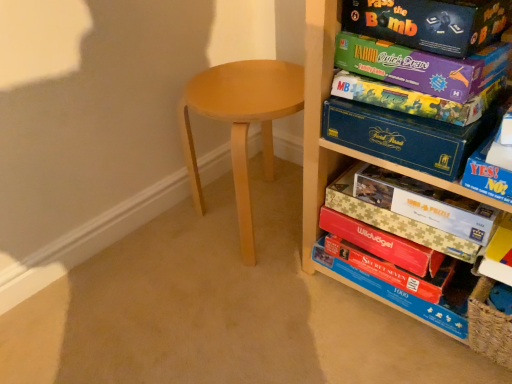
In order to face red matte puzzle box at lower right, the 6th paperback book in the top-to-bottom sequence, should I rotate leftwards or rightwards?

Rotate your view right by about 17.339°.

Describe the element at coordinates (429, 23) in the screenshot. The image size is (512, 384). I see `matte black game box at upper right, arranged as the sixth paperback book when ordered from the bottom` at that location.

What is the approximate height of matte purple board game at upper right, the third paperback book in the top-to-bottom sequence?

matte purple board game at upper right, the third paperback book in the top-to-bottom sequence, is 1.65 inches in height.

Identify the location of blue cardboard box at right, which ranks as the 3th paperback book in bottom-to-top order. (403, 136).

What do you see at coordinates (241, 123) in the screenshot?
I see `light brown wood stool at center` at bounding box center [241, 123].

Find the location of `blue cardboard box at right`. blue cardboard box at right is located at coordinates (490, 170).

I want to click on red matte puzzle box at lower right, the 6th paperback book in the top-to-bottom sequence, so click(392, 270).

Can you confirm if matte cardboard game box at upper right, which is counted as the 2th paperback book, starting from the top, is positioned to the right of matte black game box at upper right, arranged as the sixth paperback book when ordered from the bottom?

Correct, you'll find matte cardboard game box at upper right, which is counted as the 2th paperback book, starting from the top, to the right of matte black game box at upper right, arranged as the sixth paperback book when ordered from the bottom.

From a real-world perspective, relative to matte black game box at upper right, arranged as the sixth paperback book when ordered from the bottom, is matte cardboard game box at upper right, which is the fifth paperback book in bottom-to-top order, vertically above or below?

In terms of real-world spatial position, matte cardboard game box at upper right, which is the fifth paperback book in bottom-to-top order, is below matte black game box at upper right, arranged as the sixth paperback book when ordered from the bottom.

Where is `paperback book that is the 1st one when counting rightward from the matte black game box at upper right, arranged as the sixth paperback book when ordered from the bottom`? paperback book that is the 1st one when counting rightward from the matte black game box at upper right, arranged as the sixth paperback book when ordered from the bottom is located at coordinates (420, 66).

Considering the relative positions of matte cardboard game box at upper right, which is counted as the 2th paperback book, starting from the top, and matte black game box at upper right, arranged as the sixth paperback book when ordered from the bottom, in the image provided, is matte cardboard game box at upper right, which is counted as the 2th paperback book, starting from the top, behind matte black game box at upper right, arranged as the sixth paperback book when ordered from the bottom,?

Yes.

Find the location of a particular element. book lying behind the blue cardboard box at right is located at coordinates (395, 220).

Which is behind, point (485, 158) or point (352, 165)?

The point (352, 165) is more distant.

Is blue cardboard box at right bigger than blue cardboard puzzle at lower right?

No, blue cardboard box at right is not bigger than blue cardboard puzzle at lower right.

From the image's perspective, is blue cardboard box at right located above or below blue cardboard puzzle at lower right?

Clearly, from the image's perspective, blue cardboard box at right is above blue cardboard puzzle at lower right.

Considering the positions of objects blue cardboard box at right, which ranks as the 3th paperback book in bottom-to-top order, and matte purple board game at upper right, placed as the 4th paperback book when sorted from bottom to top, in the image provided, who is behind, blue cardboard box at right, which ranks as the 3th paperback book in bottom-to-top order, or matte purple board game at upper right, placed as the 4th paperback book when sorted from bottom to top,?

matte purple board game at upper right, placed as the 4th paperback book when sorted from bottom to top, is behind.

From a real-world perspective, is blue cardboard box at right, which appears as the fourth paperback book when viewed from the top, positioned over matte purple board game at upper right, placed as the 4th paperback book when sorted from bottom to top, based on gravity?

Incorrect, from a real-world perspective, blue cardboard box at right, which appears as the fourth paperback book when viewed from the top, is lower than matte purple board game at upper right, placed as the 4th paperback book when sorted from bottom to top.

Would you consider blue cardboard box at right, which ranks as the 3th paperback book in bottom-to-top order, to be distant from matte purple board game at upper right, placed as the 4th paperback book when sorted from bottom to top?

No, blue cardboard box at right, which ranks as the 3th paperback book in bottom-to-top order, is not far away from matte purple board game at upper right, placed as the 4th paperback book when sorted from bottom to top.

In the scene shown: Considering the sizes of objects blue cardboard box at right, which appears as the fourth paperback book when viewed from the top, and matte purple board game at upper right, the third paperback book in the top-to-bottom sequence, in the image provided, who is taller, blue cardboard box at right, which appears as the fourth paperback book when viewed from the top, or matte purple board game at upper right, the third paperback book in the top-to-bottom sequence,?

Standing taller between the two is blue cardboard box at right, which appears as the fourth paperback book when viewed from the top.

Which paperback book is the 2nd one when counting from the back of the matte cardboard game box at upper right, which is the fifth paperback book in bottom-to-top order? Please provide its 2D coordinates.

[(411, 99)]

Which object is positioned more to the left, matte purple board game at upper right, placed as the 4th paperback book when sorted from bottom to top, or matte cardboard game box at upper right, which is counted as the 2th paperback book, starting from the top?

matte purple board game at upper right, placed as the 4th paperback book when sorted from bottom to top.

Is matte purple board game at upper right, placed as the 4th paperback book when sorted from bottom to top, positioned behind matte cardboard game box at upper right, which is counted as the 2th paperback book, starting from the top?

Yes, it is behind matte cardboard game box at upper right, which is counted as the 2th paperback book, starting from the top.

Is matte purple board game at upper right, placed as the 4th paperback book when sorted from bottom to top, not near matte cardboard game box at upper right, which is the fifth paperback book in bottom-to-top order?

No, matte purple board game at upper right, placed as the 4th paperback book when sorted from bottom to top, is in close proximity to matte cardboard game box at upper right, which is the fifth paperback book in bottom-to-top order.

From the picture: Is wooden shelf at right facing towards matte purple board game at upper right, the third paperback book in the top-to-bottom sequence?

Yes, wooden shelf at right is aimed at matte purple board game at upper right, the third paperback book in the top-to-bottom sequence.

Which is more to the right, wooden shelf at right or matte purple board game at upper right, the third paperback book in the top-to-bottom sequence?

wooden shelf at right.

Is wooden shelf at right bigger than matte purple board game at upper right, placed as the 4th paperback book when sorted from bottom to top?

Yes, wooden shelf at right is bigger than matte purple board game at upper right, placed as the 4th paperback book when sorted from bottom to top.

Is the position of wooden shelf at right more distant than that of matte purple board game at upper right, placed as the 4th paperback book when sorted from bottom to top?

No.

Is point (426, 151) behind point (489, 208)?

No, it is not.

Which object is positioned more to the left, blue cardboard box at right, which ranks as the 3th paperback book in bottom-to-top order, or beige cardboard puzzle at center-right, the 5th paperback book viewed from the top?

blue cardboard box at right, which ranks as the 3th paperback book in bottom-to-top order.

Looking at this image, from the image's perspective, is blue cardboard box at right, which appears as the fourth paperback book when viewed from the top, below beige cardboard puzzle at center-right, the 2th paperback book from the bottom?

No, from the image's perspective, blue cardboard box at right, which appears as the fourth paperback book when viewed from the top, is not below beige cardboard puzzle at center-right, the 2th paperback book from the bottom.

Is blue cardboard box at right, which appears as the fourth paperback book when viewed from the top, not inside beige cardboard puzzle at center-right, the 2th paperback book from the bottom?

Yes, blue cardboard box at right, which appears as the fourth paperback book when viewed from the top, is not within beige cardboard puzzle at center-right, the 2th paperback book from the bottom.

Is matte cardboard game box at upper right, which is the fifth paperback book in bottom-to-top order, surrounding matte purple board game at upper right, placed as the 4th paperback book when sorted from bottom to top?

That's incorrect, matte purple board game at upper right, placed as the 4th paperback book when sorted from bottom to top, is not inside matte cardboard game box at upper right, which is the fifth paperback book in bottom-to-top order.

Does matte cardboard game box at upper right, which is the fifth paperback book in bottom-to-top order, turn towards matte purple board game at upper right, placed as the 4th paperback book when sorted from bottom to top?

No, matte cardboard game box at upper right, which is the fifth paperback book in bottom-to-top order, is not oriented towards matte purple board game at upper right, placed as the 4th paperback book when sorted from bottom to top.

Does point (454, 69) appear closer or farther from the camera than point (479, 109)?

Point (454, 69).

Find the location of a particular element. the 1st paperback book positioned below the matte black game box at upper right, arranged as the sixth paperback book when ordered from the bottom (from a real-world perspective) is located at coordinates (420, 66).

Find the location of a particular element. Image resolution: width=512 pixels, height=384 pixels. book behind the blue cardboard box at right is located at coordinates (395, 220).

Based on their spatial positions, is matte black game box at upper right, arranged as the sixth paperback book when ordered from the bottom, or blue cardboard puzzle at lower right closer to beige cardboard puzzle at center-right, the 2th paperback book from the bottom?

blue cardboard puzzle at lower right lies closer to beige cardboard puzzle at center-right, the 2th paperback book from the bottom, than the other object.

Looking at the image, which one is located closer to wooden shelf at right, matte cardboard game box at upper right, which is counted as the 2th paperback book, starting from the top, or blue cardboard puzzle at lower right?

The object closer to wooden shelf at right is blue cardboard puzzle at lower right.

Looking at the image, which one is located further to blue cardboard puzzle at lower right, blue cardboard box at right, which ranks as the 3th paperback book in bottom-to-top order, or blue cardboard box at right?

blue cardboard box at right is further to blue cardboard puzzle at lower right.

Looking at the image, which one is located closer to matte purple board game at upper right, the third paperback book in the top-to-bottom sequence, matte cardboard game box at upper right, which is the fifth paperback book in bottom-to-top order, or red matte puzzle box at lower right, the 6th paperback book in the top-to-bottom sequence?

matte cardboard game box at upper right, which is the fifth paperback book in bottom-to-top order, is positioned closer to the anchor matte purple board game at upper right, the third paperback book in the top-to-bottom sequence.

Looking at the image, which one is located further to blue cardboard puzzle at lower right, matte purple board game at upper right, the third paperback book in the top-to-bottom sequence, or matte black game box at upper right, arranged as the sixth paperback book when ordered from the bottom?

Among the two, matte black game box at upper right, arranged as the sixth paperback book when ordered from the bottom, is located further to blue cardboard puzzle at lower right.

When comparing their distances from wooden shelf at right, does red matte puzzle box at lower right, the 1th paperback book from the bottom, or beige cardboard puzzle at center-right, the 5th paperback book viewed from the top, seem closer?

beige cardboard puzzle at center-right, the 5th paperback book viewed from the top, is positioned closer to the anchor wooden shelf at right.

Which object lies nearer to the anchor point light brown wood stool at center, beige cardboard puzzle at center-right, the 5th paperback book viewed from the top, or matte cardboard game box at upper right, which is counted as the 2th paperback book, starting from the top?

matte cardboard game box at upper right, which is counted as the 2th paperback book, starting from the top.

Looking at the image, which one is located further to matte black game box at upper right, arranged as the sixth paperback book when ordered from the bottom, beige cardboard puzzle at center-right, the 5th paperback book viewed from the top, or blue cardboard box at right?

beige cardboard puzzle at center-right, the 5th paperback book viewed from the top, is further to matte black game box at upper right, arranged as the sixth paperback book when ordered from the bottom.

What are the coordinates of `storage box between wooden shelf at right and matte purple board game at upper right, placed as the 4th paperback book when sorted from bottom to top, from front to back` in the screenshot? It's located at (490, 170).

The image size is (512, 384). Identify the location of book located between light brown wood stool at center and beige cardboard puzzle at center-right, the 2th paperback book from the bottom, in the left-right direction. (395, 220).

Find the location of a particular element. The image size is (512, 384). storage box between wooden shelf at right and blue cardboard puzzle at lower right from front to back is located at coordinates (490, 170).

Identify the location of storage box between matte cardboard game box at upper right, which is counted as the 2th paperback book, starting from the top, and blue cardboard puzzle at lower right in the up-down direction. This screenshot has height=384, width=512. (490, 170).